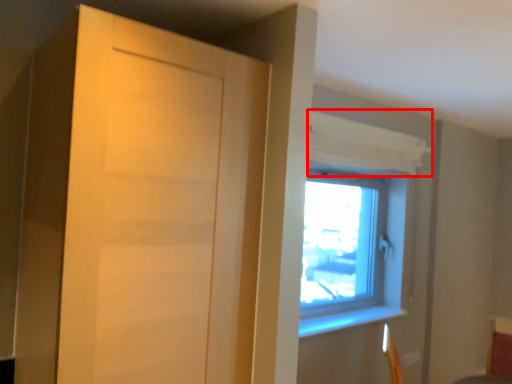
Question: From the image's perspective, what is the correct spatial positioning of curtain (annotated by the red box) in reference to door?

Choices:
 (A) above
 (B) below

Answer: (A)